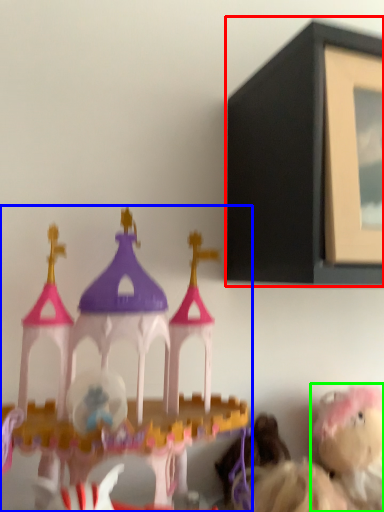
Question: Estimate the real-world distances between objects in this image. Which object is farther from picture frame (highlighted by a red box), toy (highlighted by a blue box) or toy (highlighted by a green box)?

Choices:
 (A) toy
 (B) toy

Answer: (B)